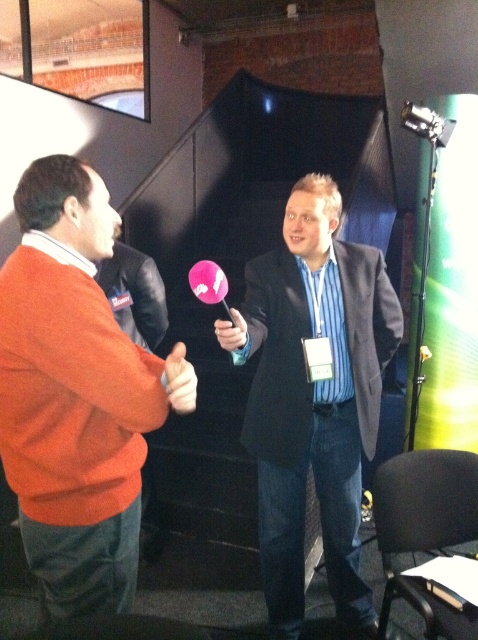
Who is positioned more to the right, black leather jacket at left or pink matte/metallic microphone at center?

pink matte/metallic microphone at center is more to the right.

Which is above, black leather jacket at left or pink matte/metallic microphone at center?

black leather jacket at left is higher up.

Does point (153, 298) come behind point (238, 330)?

Yes, point (153, 298) is farther from viewer.

Identify the location of black leather jacket at left. (134, 294).

Where is `orange sweater at left`? This screenshot has width=478, height=640. orange sweater at left is located at coordinates (73, 396).

Is point (134, 422) behind point (428, 138)?

No, it is not.

The image size is (478, 640). What do you see at coordinates (73, 396) in the screenshot? I see `orange sweater at left` at bounding box center [73, 396].

This screenshot has width=478, height=640. In order to click on orange sweater at left in this screenshot , I will do `click(73, 396)`.

Which is in front, point (412, 128) or point (231, 346)?

Point (231, 346)

Does point (430, 125) come farther from viewer compared to point (239, 326)?

Yes, point (430, 125) is farther from viewer.

Between point (444, 141) and point (217, 326), which one is positioned behind?

The point (444, 141) is behind.

Image resolution: width=478 pixels, height=640 pixels. I want to click on metallic silver microphone at upper right, so click(426, 124).